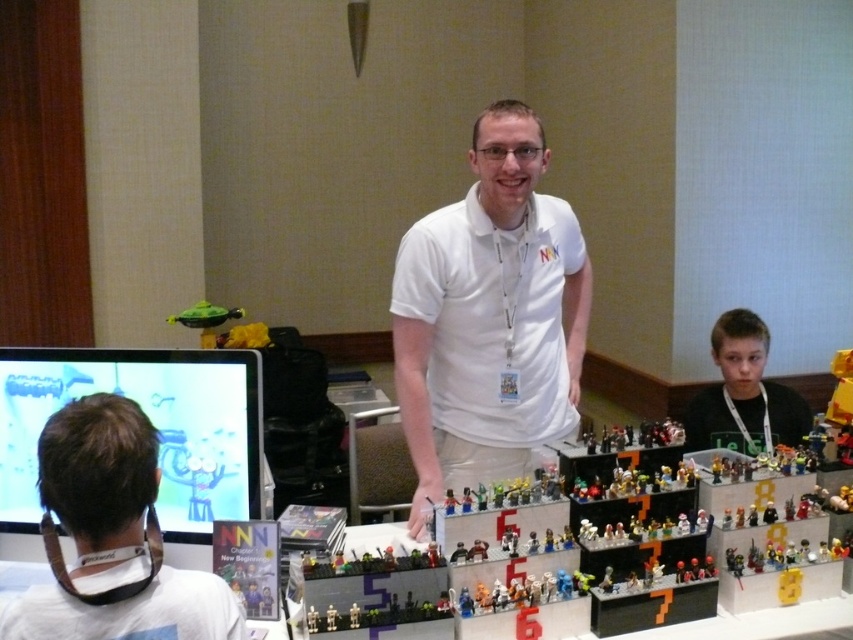
You are a photographer at the event and need to capture a clear shot of the smooth black shirt at lower right. However, the matte plastic monitor at left is blocking your view. Can you move the monitor to the side to get an unobstructed view?

The matte plastic monitor at left is in front of the smooth black shirt at lower right, so moving the monitor aside would allow you to see the smooth black shirt at lower right without obstruction.

You are a photographer at the event and need to capture a clear photo of both the white matte shirt at center and the smooth black shirt at lower right. Considering their positions, which shirt should be placed in the foreground to ensure both are visible in the frame?

The white matte shirt at center should be placed in the foreground because it is positioned over the smooth black shirt at lower right, meaning it is closer to the camera. By keeping it in the foreground, both shirts will remain visible without one blocking the other completely.